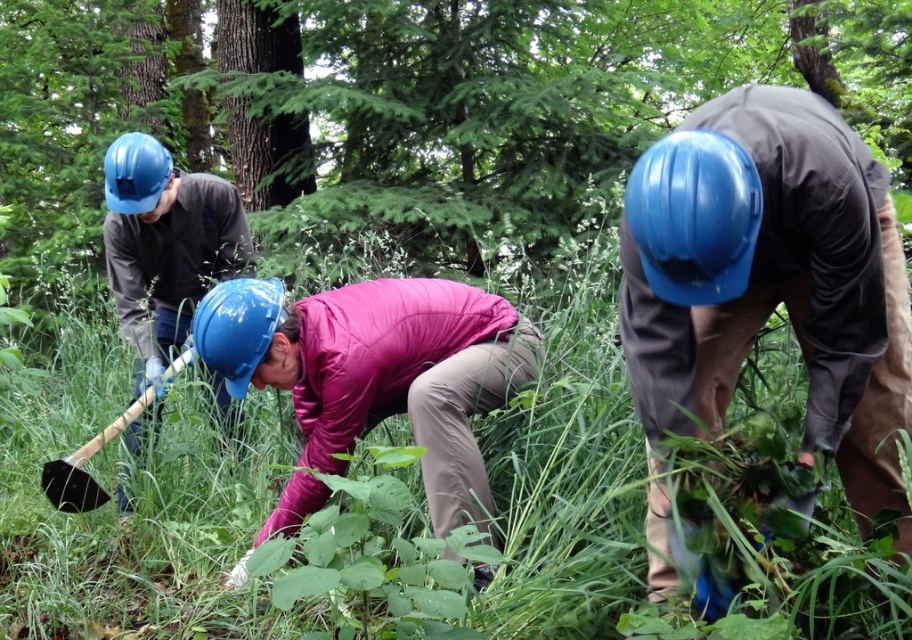
Does pink fabric jacket at center appear on the right side of matte blue helmet at left?

Yes, pink fabric jacket at center is to the right of matte blue helmet at left.

This screenshot has width=912, height=640. What do you see at coordinates (378, 369) in the screenshot? I see `pink fabric jacket at center` at bounding box center [378, 369].

Locate an element on the screen. pink fabric jacket at center is located at coordinates (378, 369).

Is point (17, 545) positioned in front of point (190, 188)?

That is True.

Does green grass at center have a greater width compared to matte blue helmet at left?

Indeed, green grass at center has a greater width compared to matte blue helmet at left.

Which is in front, point (613, 609) or point (206, 285)?

Point (613, 609) is more forward.

Identify the location of green grass at center. (136, 508).

Between blue hard hat at center and black plastic shovel at lower left, which one is positioned higher?

blue hard hat at center

Describe the element at coordinates (770, 282) in the screenshot. I see `blue hard hat at center` at that location.

You are a GUI agent. You are given a task and a screenshot of the screen. Output one action in this format:
    pyautogui.click(x=<x>, y=<y>)
    Task: Click on the blue hard hat at center
    
    Given the screenshot: What is the action you would take?
    pyautogui.click(x=770, y=282)